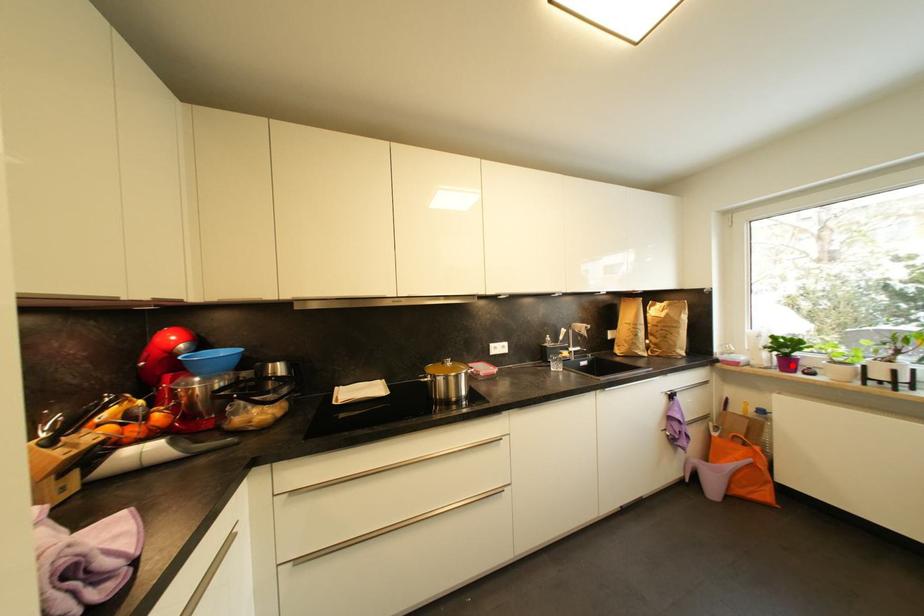
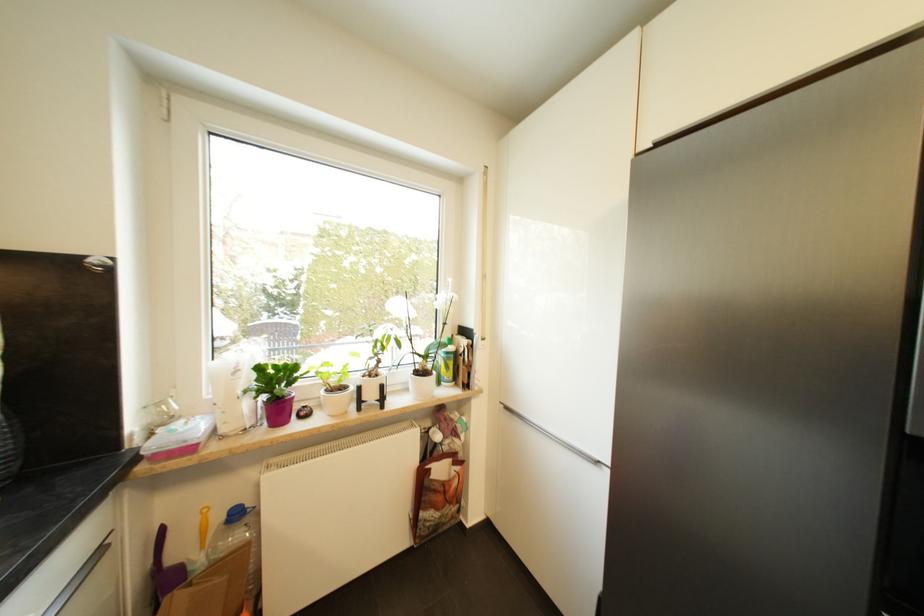
Locate, in the second image, the point that corresponds to the highlighted location in the first image.

(285, 411)